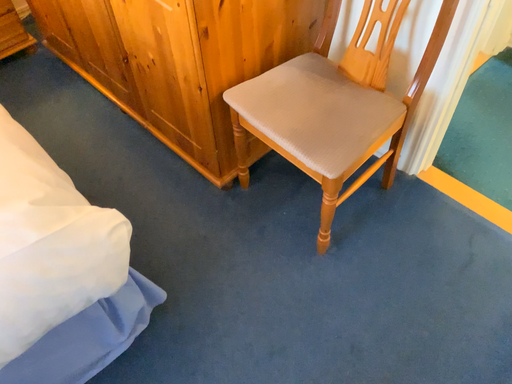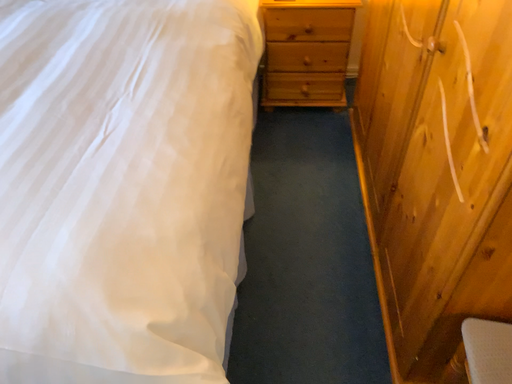
Question: Which way did the camera rotate in the video?

Choices:
 (A) rotated downward
 (B) rotated upward

Answer: (B)